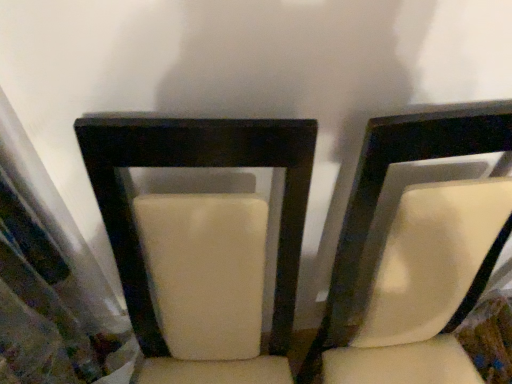
Question: Is suede-like beige chair at center, acting as the first chair starting from the left, to the left or to the right of suede-like white chair at center, which appears as the 1th chair when viewed from the right, in the image?

Choices:
 (A) left
 (B) right

Answer: (A)

Question: From the image's perspective, is suede-like beige chair at center, acting as the first chair starting from the left, located above or below suede-like white chair at center, which appears as the 1th chair when viewed from the right?

Choices:
 (A) below
 (B) above

Answer: (A)

Question: In the image, is suede-like beige chair at center, acting as the first chair starting from the left, positioned in front of or behind suede-like white chair at center, which appears as the 1th chair when viewed from the right?

Choices:
 (A) front
 (B) behind

Answer: (A)

Question: Considering their positions, is suede-like white chair at center, which is counted as the 2th chair, starting from the left, located in front of or behind suede-like beige chair at center, acting as the first chair starting from the left?

Choices:
 (A) behind
 (B) front

Answer: (A)

Question: In terms of width, does suede-like white chair at center, which appears as the 1th chair when viewed from the right, look wider or thinner when compared to suede-like beige chair at center, marked as the second chair in a right-to-left arrangement?

Choices:
 (A) thin
 (B) wide

Answer: (A)

Question: Is suede-like white chair at center, which appears as the 1th chair when viewed from the right, spatially inside suede-like beige chair at center, acting as the first chair starting from the left, or outside of it?

Choices:
 (A) inside
 (B) outside

Answer: (B)

Question: From a real-world perspective, is suede-like white chair at center, which is counted as the 2th chair, starting from the left, physically located above or below suede-like beige chair at center, marked as the second chair in a right-to-left arrangement?

Choices:
 (A) below
 (B) above

Answer: (B)